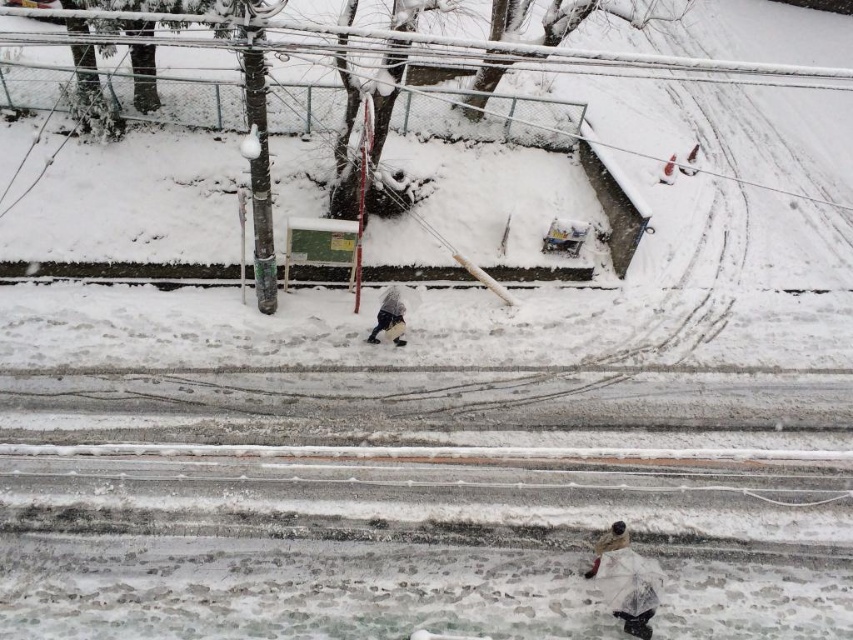
Question: Does white matte umbrella at lower right come in front of dark gray fabric jacket at center?

Choices:
 (A) no
 (B) yes

Answer: (B)

Question: Which of the following is the closest to the observer?

Choices:
 (A) (381, 305)
 (B) (602, 557)

Answer: (B)

Question: In this image, where is white matte umbrella at lower right located relative to dark gray fabric jacket at center?

Choices:
 (A) left
 (B) right

Answer: (B)

Question: Does white matte umbrella at lower right come behind dark gray fabric jacket at center?

Choices:
 (A) no
 (B) yes

Answer: (A)